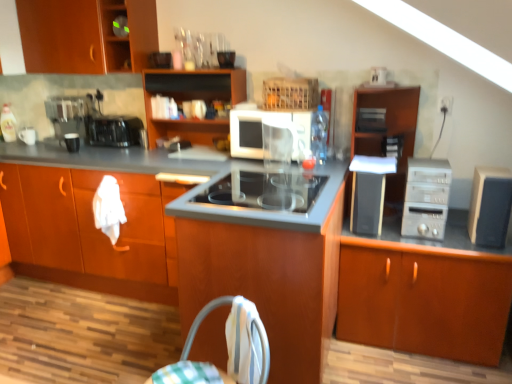
I want to click on free point to the right of white glossy mug at left, placed as the fifth appliance when sorted from front to back, so click(x=47, y=144).